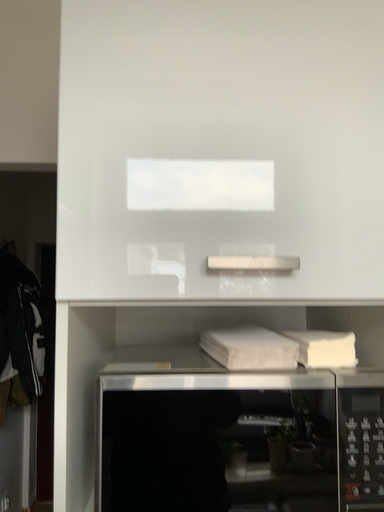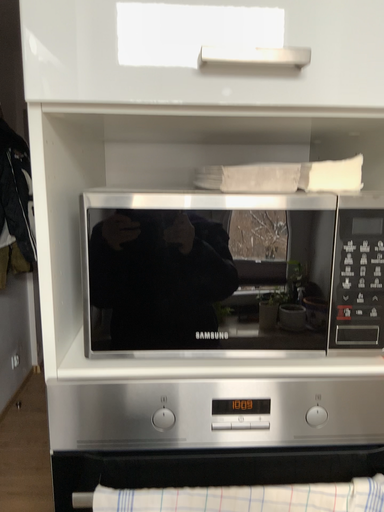
Question: How did the camera likely rotate when shooting the video?

Choices:
 (A) rotated upward
 (B) rotated downward

Answer: (B)